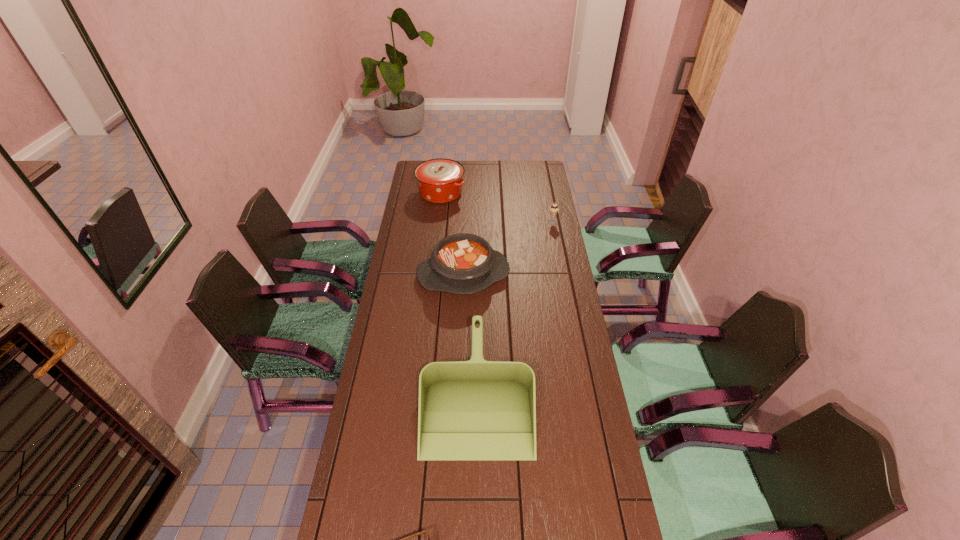
Where is `vacant space located on the scoop of the dustpan`? The width and height of the screenshot is (960, 540). vacant space located on the scoop of the dustpan is located at coordinates (477, 478).

Find the location of a particular element. This screenshot has height=540, width=960. object located in the far edge section of the desktop is located at coordinates (440, 180).

You are a GUI agent. You are given a task and a screenshot of the screen. Output one action in this format:
    pyautogui.click(x=<x>, y=<y>)
    Task: Click on the object that is at the right edge
    
    Given the screenshot: What is the action you would take?
    pyautogui.click(x=553, y=209)

You are a GUI agent. You are given a task and a screenshot of the screen. Output one action in this format:
    pyautogui.click(x=<x>, y=<y>)
    Task: Click on the object that is at the far left corner
    The image size is (960, 540).
    Given the screenshot: What is the action you would take?
    pyautogui.click(x=440, y=180)

At what (x,y) coordinates should I click in order to perform the action: click on vacant space at the far edge of the desktop. Please return your answer as a coordinate pair (x, y). This screenshot has width=960, height=540. Looking at the image, I should click on (472, 178).

The height and width of the screenshot is (540, 960). I want to click on vacant area at the left edge of the desktop, so click(415, 191).

At what (x,y) coordinates should I click in order to perform the action: click on vacant space at the right edge. Please return your answer as a coordinate pair (x, y). Looking at the image, I should click on (569, 327).

Find the location of `free space between the third nearest object and the rightmost object`. free space between the third nearest object and the rightmost object is located at coordinates (508, 248).

Where is `free space between the third nearest object and the fourth farthest object`? free space between the third nearest object and the fourth farthest object is located at coordinates (470, 332).

You are a GUI agent. You are given a task and a screenshot of the screen. Output one action in this format:
    pyautogui.click(x=<x>, y=<y>)
    Task: Click on the free point between the shorter casserole and the tallest object
    The image size is (960, 540).
    Given the screenshot: What is the action you would take?
    pyautogui.click(x=452, y=234)